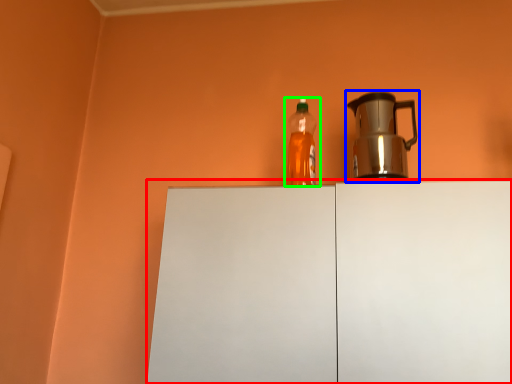
Question: Which is nearer to the cabinetry (highlighted by a red box)? kettle (highlighted by a blue box) or bottle (highlighted by a green box).

Choices:
 (A) kettle
 (B) bottle

Answer: (B)